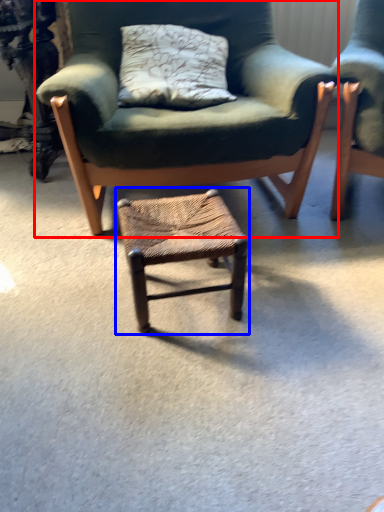
Question: Which object appears closest to the camera in this image, chair (highlighted by a red box) or stool (highlighted by a blue box)?

Choices:
 (A) chair
 (B) stool

Answer: (B)